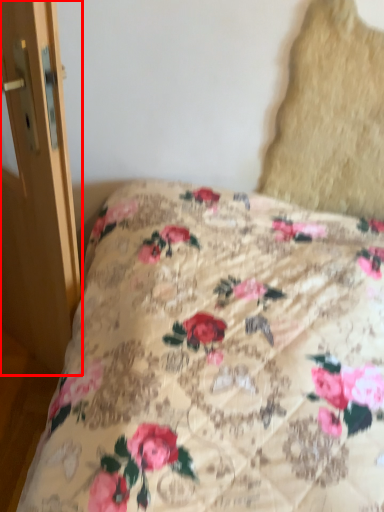
Question: In this image, where is screen door (annotated by the red box) located relative to pillow?

Choices:
 (A) right
 (B) left

Answer: (B)